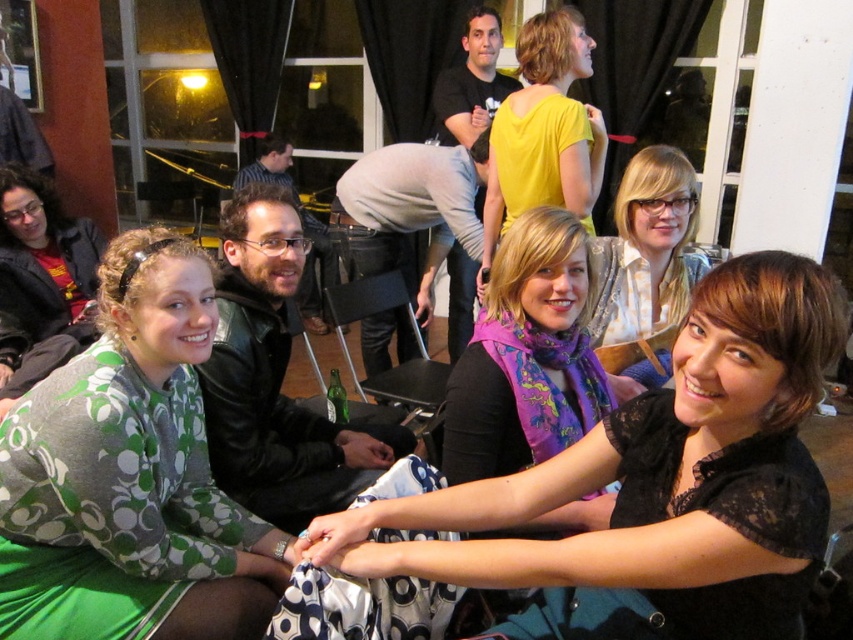
Question: Based on their relative distances, which object is nearer to the yellow matte shirt at upper center?

Choices:
 (A) green printed dress at lower left
 (B) matte white blouse at center
 (C) black lace shirt at center
 (D) purple silk scarf at center

Answer: (B)

Question: From the image, what is the correct spatial relationship of purple silk scarf at center in relation to matte white blouse at center?

Choices:
 (A) below
 (B) above

Answer: (A)

Question: Is yellow matte shirt at upper center to the right of matte white blouse at center from the viewer's perspective?

Choices:
 (A) yes
 (B) no

Answer: (B)

Question: Is yellow matte shirt at upper center thinner than matte white blouse at center?

Choices:
 (A) no
 (B) yes

Answer: (B)

Question: Which object is the closest to the green printed dress at lower left?

Choices:
 (A) black lace shirt at center
 (B) purple silk scarf at center
 (C) yellow matte shirt at upper center

Answer: (A)

Question: Which is farther from the yellow matte shirt at upper center?

Choices:
 (A) purple silk scarf at center
 (B) matte white blouse at center
 (C) green printed dress at lower left

Answer: (C)